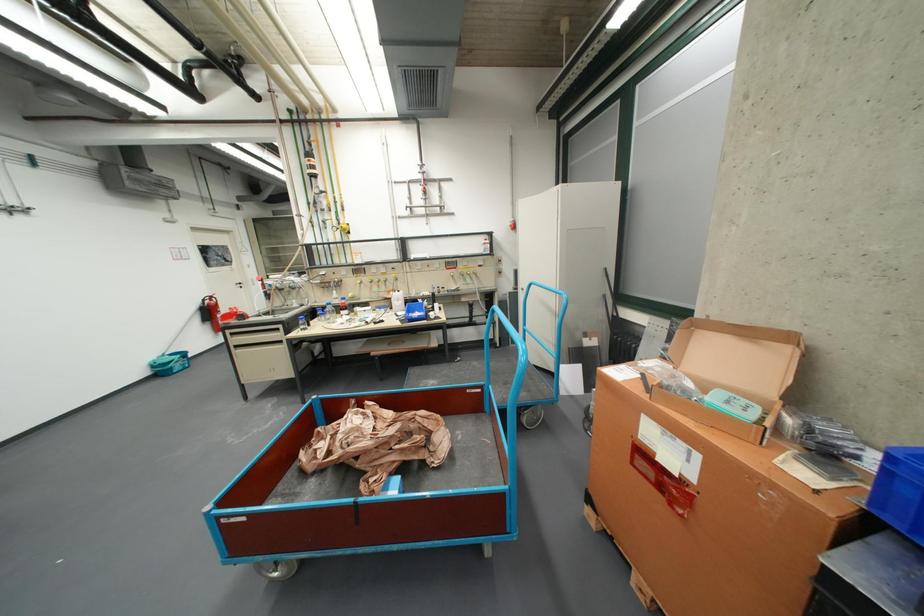
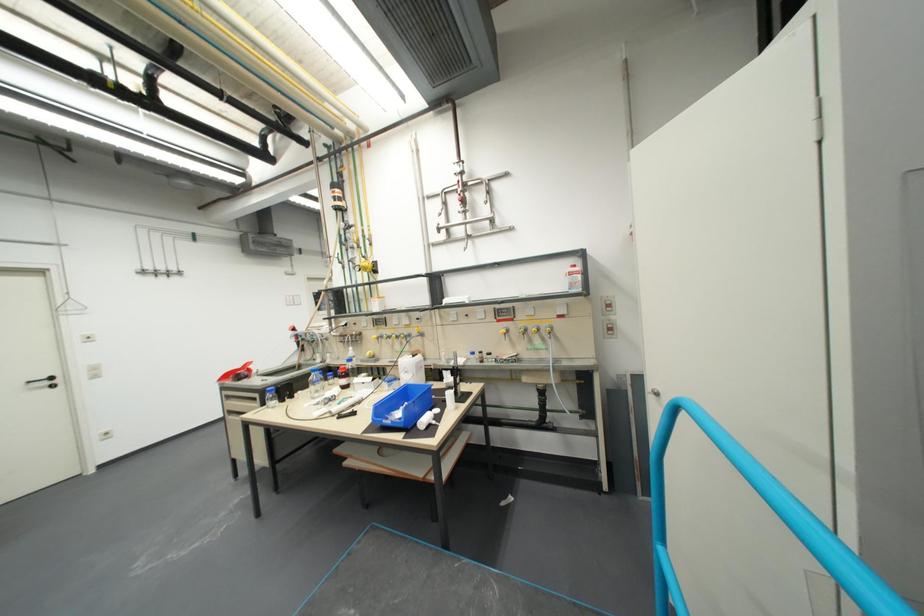
Where in the second image is the point corresponding to (x=523, y=346) from the first image?

(652, 498)